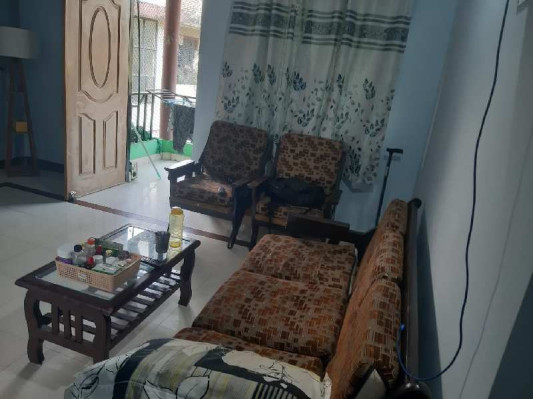
At what (x,y) coordinates should I click in order to perform the action: click on floor lamp. Please return your answer as a coordinate pair (x, y). Image resolution: width=533 pixels, height=399 pixels. Looking at the image, I should click on (15, 81).